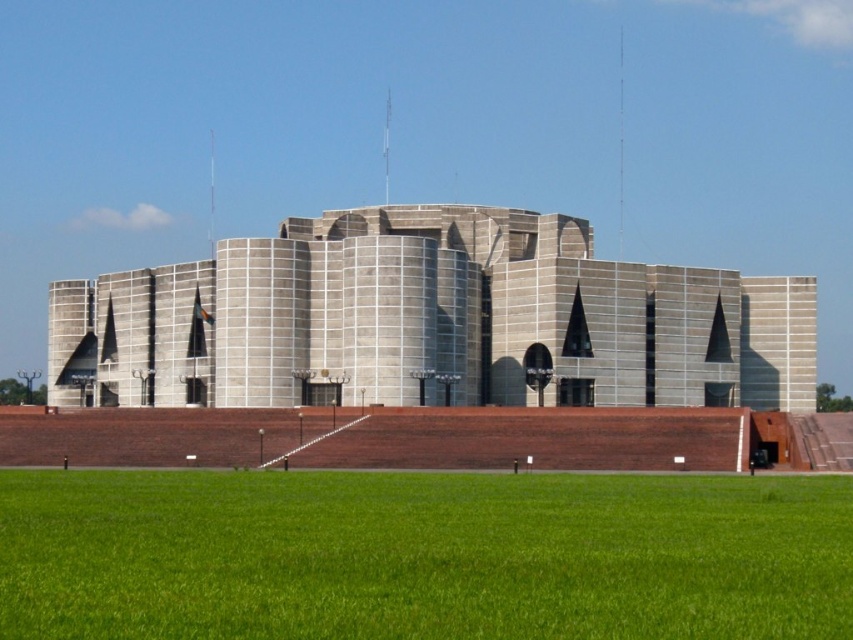
Question: Among these points, which one is nearest to the camera?

Choices:
 (A) (537, 509)
 (B) (427, 248)

Answer: (A)

Question: Is green grass at lower center in front of gray concrete building at center?

Choices:
 (A) yes
 (B) no

Answer: (A)

Question: Which point is closer to the camera taking this photo?

Choices:
 (A) (201, 300)
 (B) (91, 609)

Answer: (B)

Question: In this image, where is green grass at lower center located relative to gray concrete building at center?

Choices:
 (A) left
 (B) right

Answer: (B)

Question: Does green grass at lower center have a smaller size compared to gray concrete building at center?

Choices:
 (A) yes
 (B) no

Answer: (A)

Question: Which object is closer to the camera taking this photo?

Choices:
 (A) green grass at lower center
 (B) gray concrete building at center

Answer: (A)